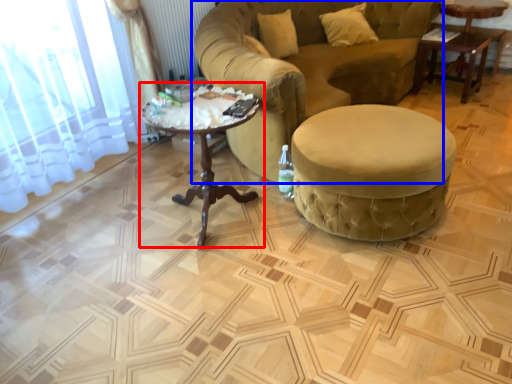
Question: Which of the following is the closest to the observer, coffee table (highlighted by a red box) or studio couch (highlighted by a blue box)?

Choices:
 (A) coffee table
 (B) studio couch

Answer: (A)